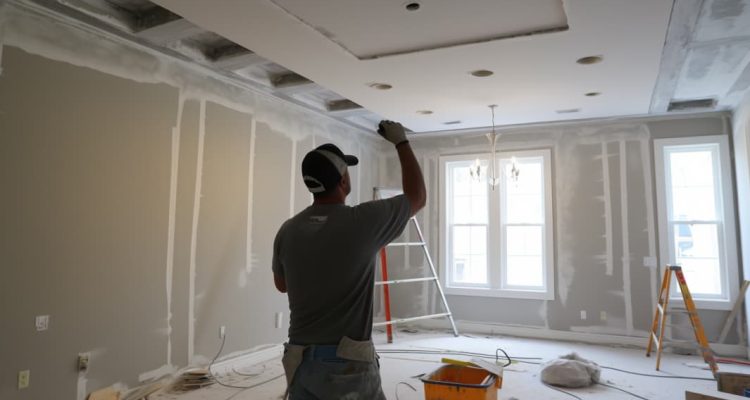
Locate an element on the screen. bucket is located at coordinates (462, 391).